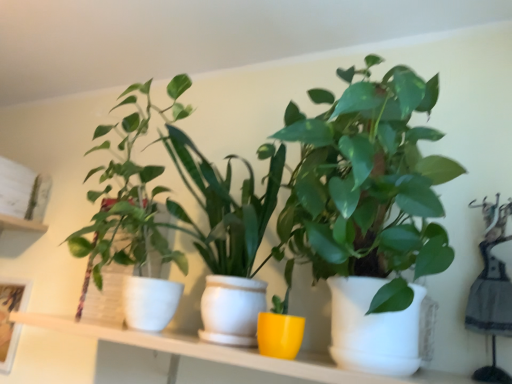
Question: In the image, is green matte plant at center, which is the first houseplant in right-to-left order, positioned in front of or behind white ceramic shelf at center?

Choices:
 (A) behind
 (B) front

Answer: (B)

Question: Visually, is green matte plant at center, which is the 2th houseplant from left to right, positioned to the left or to the right of white ceramic shelf at center?

Choices:
 (A) left
 (B) right

Answer: (B)

Question: Estimate the real-world distances between objects in this image. Which object is closer to the white ceramic shelf at center?

Choices:
 (A) green matte plant at center, which is the 2th houseplant from left to right
 (B) woven basket plant at left, placed as the second houseplant when sorted from right to left

Answer: (A)

Question: Based on their relative distances, which object is farther from the green matte plant at center, which is the 2th houseplant from left to right?

Choices:
 (A) white ceramic shelf at center
 (B) woven basket plant at left, the 1th houseplant viewed from the left

Answer: (A)